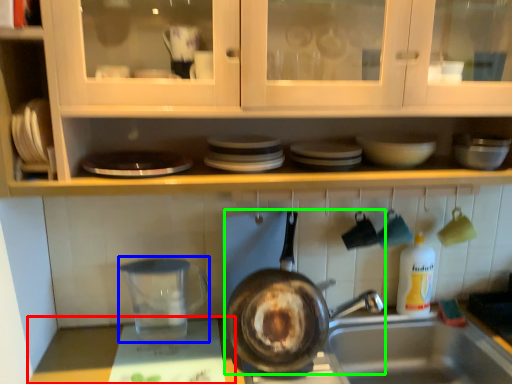
Question: Considering the real-world distances, which object is farthest from counter top (highlighted by a red box)? appliance (highlighted by a blue box) or frying pan (highlighted by a green box)?

Choices:
 (A) appliance
 (B) frying pan

Answer: (B)